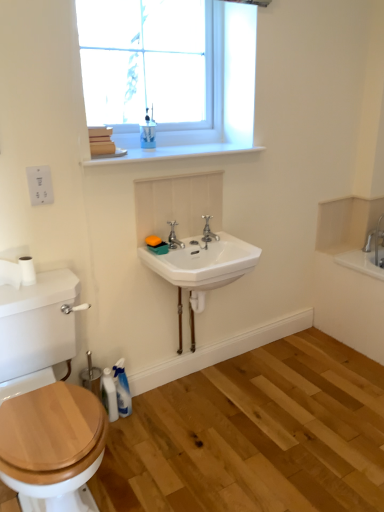
Question: Considering the positions of white glossy bottle at lower left and silver metallic faucet at center, which appears as the second tap when viewed from the right, in the image, is white glossy bottle at lower left bigger or smaller than silver metallic faucet at center, which appears as the second tap when viewed from the right,?

Choices:
 (A) small
 (B) big

Answer: (B)

Question: From a real-world perspective, is white glossy bottle at lower left physically located above or below silver metallic faucet at center, the first tap positioned from the left?

Choices:
 (A) below
 (B) above

Answer: (A)

Question: Which object is the closest to the white ceramic sink at center?

Choices:
 (A) white matte toilet paper at left
 (B) clear glass window at upper center
 (C) translucent plastic spray bottle at lower left, the 2th toiletry viewed from the top
 (D) silver metallic faucet at center, the first tap positioned from the left
 (E) polished chrome faucet at center, marked as the 1th tap in a right-to-left arrangement

Answer: (D)

Question: Which of these objects is positioned closest to the white matte toilet paper at left?

Choices:
 (A) white glossy bottle at lower left
 (B) blue glossy cup at upper center, the 1th toiletry viewed from the right
 (C) white glossy window sill at upper center
 (D) silver metallic faucet at center, the first tap positioned from the left
 (E) white plastic electric outlet at upper left

Answer: (E)